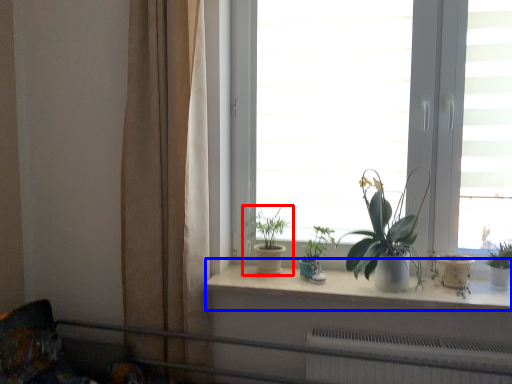
Question: Among these objects, which one is farthest to the camera, houseplant (highlighted by a red box) or window sill (highlighted by a blue box)?

Choices:
 (A) houseplant
 (B) window sill

Answer: (A)